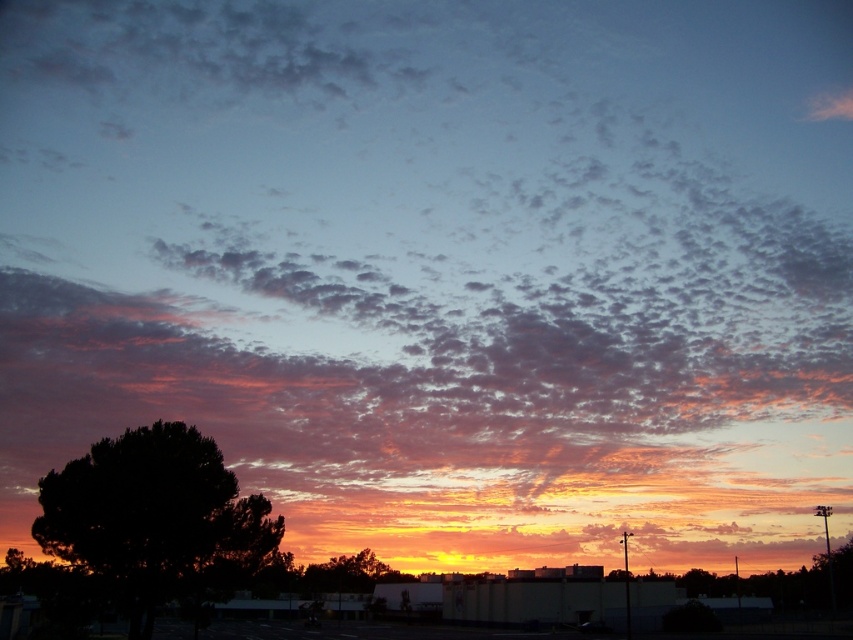
You are an artist trying to capture the sunset scene. You notice two trees in the foreground. Which tree, the dark green leafy tree at lower left or the green leafy tree at center, would appear smaller in your painting if you want to maintain the correct perspective?

The dark green leafy tree at lower left is smaller than the green leafy tree at center, so it would appear smaller in the painting to maintain correct perspective.